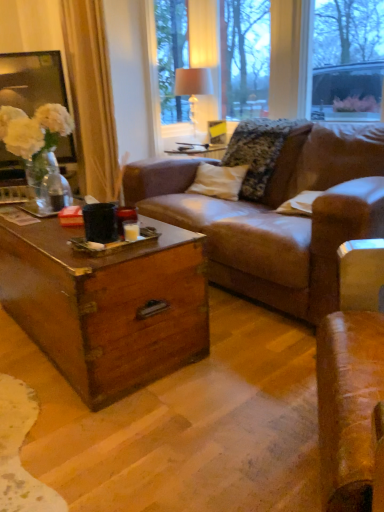
Question: Considering the positions of white fabric lampshade at upper center and beige fabric curtain at left in the image, is white fabric lampshade at upper center taller or shorter than beige fabric curtain at left?

Choices:
 (A) short
 (B) tall

Answer: (A)

Question: Does point (190, 117) appear closer or farther from the camera than point (79, 125)?

Choices:
 (A) farther
 (B) closer

Answer: (A)

Question: Which object is the farthest from the beige fabric curtain at left?

Choices:
 (A) white fabric lampshade at upper center
 (B) fluffy fabric pillow at center
 (C) matte glass vase at upper center

Answer: (B)

Question: Which object is the closest to the beige fabric curtain at left?

Choices:
 (A) white fabric lampshade at upper center
 (B) matte glass vase at upper center
 (C) fluffy fabric pillow at center

Answer: (A)